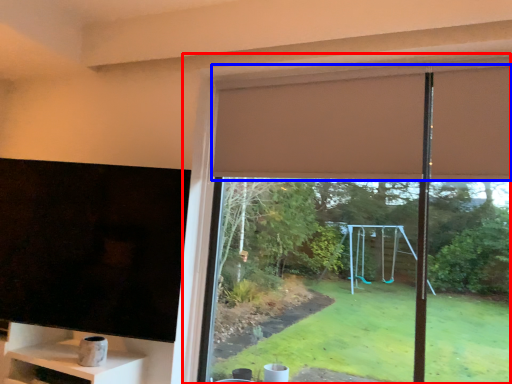
Question: Which object is further to the camera taking this photo, window (highlighted by a red box) or curtain (highlighted by a blue box)?

Choices:
 (A) window
 (B) curtain

Answer: (B)